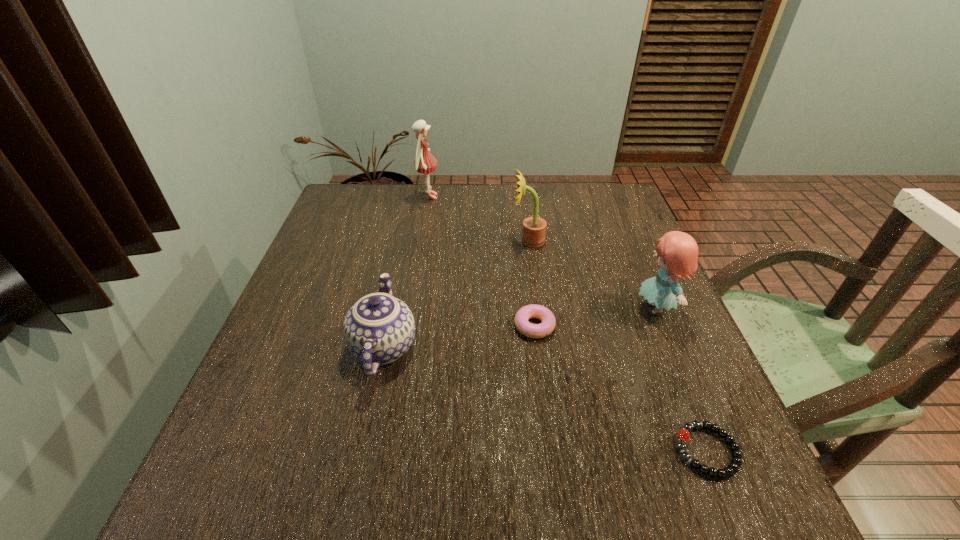
In the image, there is a desktop. At what (x,y) coordinates should I click in order to perform the action: click on free space at the far right corner. Please return your answer as a coordinate pair (x, y). Image resolution: width=960 pixels, height=540 pixels. Looking at the image, I should click on (587, 218).

Identify the location of vacant point located between the left doll and the fifth tallest object. (481, 261).

Identify the location of blank region between the left doll and the fourth tallest object. (406, 272).

Locate an element on the screen. Image resolution: width=960 pixels, height=540 pixels. blank region between the bracelet and the shorter doll is located at coordinates (682, 380).

At what (x,y) coordinates should I click in order to perform the action: click on blank region between the bracelet and the taller doll. Please return your answer as a coordinate pair (x, y). This screenshot has width=960, height=540. Looking at the image, I should click on (567, 323).

Where is `blank region between the third shortest object and the bracelet`? blank region between the third shortest object and the bracelet is located at coordinates (545, 399).

The width and height of the screenshot is (960, 540). Identify the location of unoccupied position between the shortest object and the fifth tallest object. (620, 388).

Identify the location of vacant space that's between the sunflower and the chinaware. The image size is (960, 540). (456, 294).

Find the location of a particular element. Image resolution: width=960 pixels, height=540 pixels. vacant area between the left doll and the fourth tallest object is located at coordinates (406, 272).

I want to click on object that is the fifth nearest to the right doll, so click(424, 162).